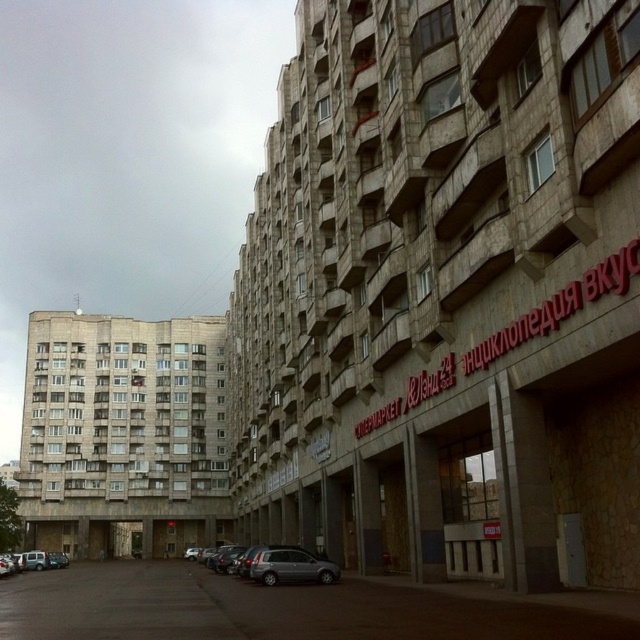
You are a delivery driver needing to park your car, which is 5 meters long, between the silver metallic car at lower center and the silver metallic car at lower left. Can you fit your car in the space between them?

The distance between the silver metallic car at lower center and the silver metallic car at lower left is 30.07 meters. Since your car is only 5 meters long, there is more than enough space to park between them.

You are a delivery driver who needs to park your car in this area. You have two identical cars to choose from. The first car is the silver metallic car at lower center, and the second is the silver metallic car at lower left. Which car will require a wider parking space?

The silver metallic car at lower left requires a wider parking space because its width is greater than the silver metallic car at lower center.